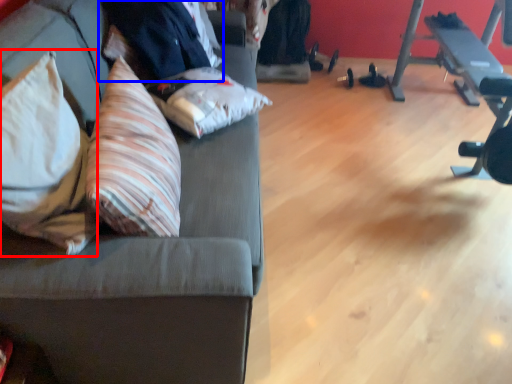
Question: Which object is closer to the camera taking this photo, throw pillow (highlighted by a red box) or businessman (highlighted by a blue box)?

Choices:
 (A) throw pillow
 (B) businessman

Answer: (A)